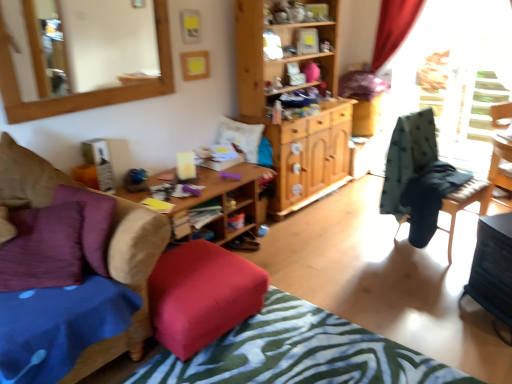
Question: From the image's perspective, would you say wooden desk at center is positioned over wooden chair at right, the second chair when ordered from front to back?

Choices:
 (A) no
 (B) yes

Answer: (A)

Question: Can you confirm if wooden desk at center is smaller than wooden chair at right, the second chair when ordered from front to back?

Choices:
 (A) no
 (B) yes

Answer: (A)

Question: Is wooden desk at center to the right of wooden chair at right, placed as the 1th chair when sorted from right to left, from the viewer's perspective?

Choices:
 (A) yes
 (B) no

Answer: (B)

Question: Is wooden desk at center positioned with its back to wooden chair at right, the first chair from the back?

Choices:
 (A) yes
 (B) no

Answer: (B)

Question: Can you confirm if wooden desk at center is bigger than wooden chair at right, the first chair from the back?

Choices:
 (A) no
 (B) yes

Answer: (B)

Question: From the image's perspective, is wooden desk at center under wooden chair at right, placed as the 1th chair when sorted from right to left?

Choices:
 (A) yes
 (B) no

Answer: (A)

Question: Is wooden-framed mirror at upper left bigger than textured green and white bedspread at lower center?

Choices:
 (A) no
 (B) yes

Answer: (A)

Question: Is wooden-framed mirror at upper left not near textured green and white bedspread at lower center?

Choices:
 (A) yes
 (B) no

Answer: (A)

Question: Is wooden-framed mirror at upper left positioned in front of textured green and white bedspread at lower center?

Choices:
 (A) yes
 (B) no

Answer: (B)

Question: From the image's perspective, is wooden-framed mirror at upper left on textured green and white bedspread at lower center?

Choices:
 (A) no
 (B) yes

Answer: (B)

Question: Is the depth of wooden-framed mirror at upper left greater than that of textured green and white bedspread at lower center?

Choices:
 (A) no
 (B) yes

Answer: (B)

Question: Considering the relative sizes of wooden-framed mirror at upper left and textured green and white bedspread at lower center in the image provided, is wooden-framed mirror at upper left smaller than textured green and white bedspread at lower center?

Choices:
 (A) no
 (B) yes

Answer: (B)

Question: From a real-world perspective, is velvet cushion at lower left, which is the 1th chair from left to right, below white soft pillow at center, the 1th pillow from the right?

Choices:
 (A) no
 (B) yes

Answer: (B)